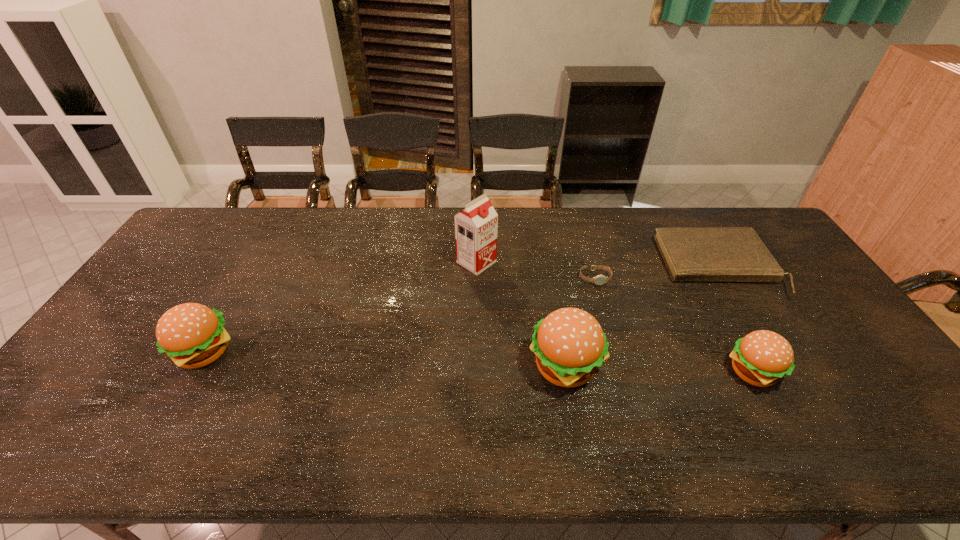
Where is `free space between the shortest object and the paperback book`? free space between the shortest object and the paperback book is located at coordinates (657, 273).

At what (x,y) coordinates should I click in order to perform the action: click on vacant area that lies between the leftmost object and the shortest hamburger. Please return your answer as a coordinate pair (x, y). Looking at the image, I should click on (479, 363).

Identify which object is the third nearest to the soya milk. Please provide its 2D coordinates. Your answer should be formatted as a tuple, i.e. [(x, y)], where the tuple contains the x and y coordinates of a point satisfying the conditions above.

[(691, 254)]

This screenshot has height=540, width=960. Find the location of `object that is the second closest to the tallest object`. object that is the second closest to the tallest object is located at coordinates (600, 279).

Point out which hamburger is positioned as the second nearest to the leftmost hamburger. Please provide its 2D coordinates. Your answer should be formatted as a tuple, i.e. [(x, y)], where the tuple contains the x and y coordinates of a point satisfying the conditions above.

[(761, 358)]

I want to click on the closest hamburger to the second hamburger from right to left, so click(x=761, y=358).